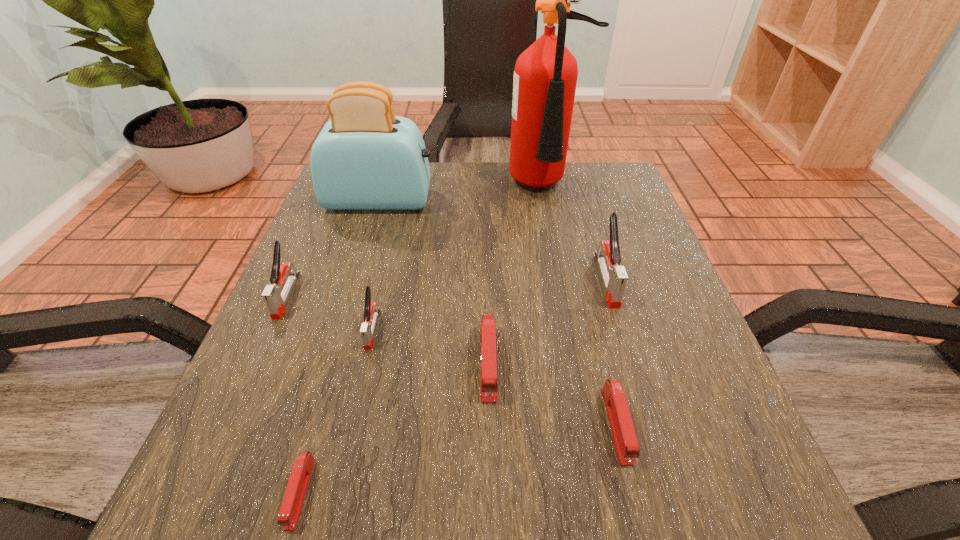
Locate an element on the screen. The image size is (960, 540). fire extinguisher is located at coordinates (545, 75).

This screenshot has width=960, height=540. I want to click on red fire extinguisher, so click(x=545, y=75).

Find the location of a particular element. light toaster is located at coordinates (365, 158).

You are a GUI agent. You are given a task and a screenshot of the screen. Output one action in this format:
    pyautogui.click(x=<x>, y=<y>)
    Task: Click on the toaster
    
    Given the screenshot: What is the action you would take?
    pyautogui.click(x=365, y=158)

What are the coordinates of `the biggest gray stapler` in the screenshot? It's located at (614, 276).

Identify the location of the rightmost stapler. (614, 276).

The height and width of the screenshot is (540, 960). Identify the location of the leftmost stapler. (275, 299).

What are the coordinates of `the fifth shortest object` in the screenshot? It's located at (275, 299).

You are a GUI agent. You are given a task and a screenshot of the screen. Output one action in this format:
    pyautogui.click(x=<x>, y=<y>)
    Task: Click on the second gray stapler from left to right
    
    Given the screenshot: What is the action you would take?
    pyautogui.click(x=371, y=311)

Locate an element on the screen. The height and width of the screenshot is (540, 960). the smallest gray stapler is located at coordinates (371, 311).